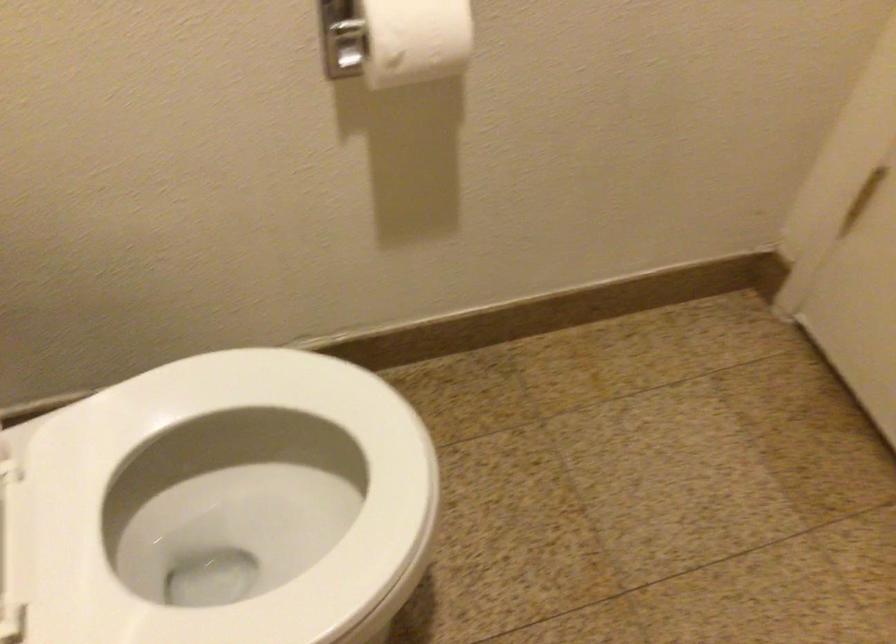
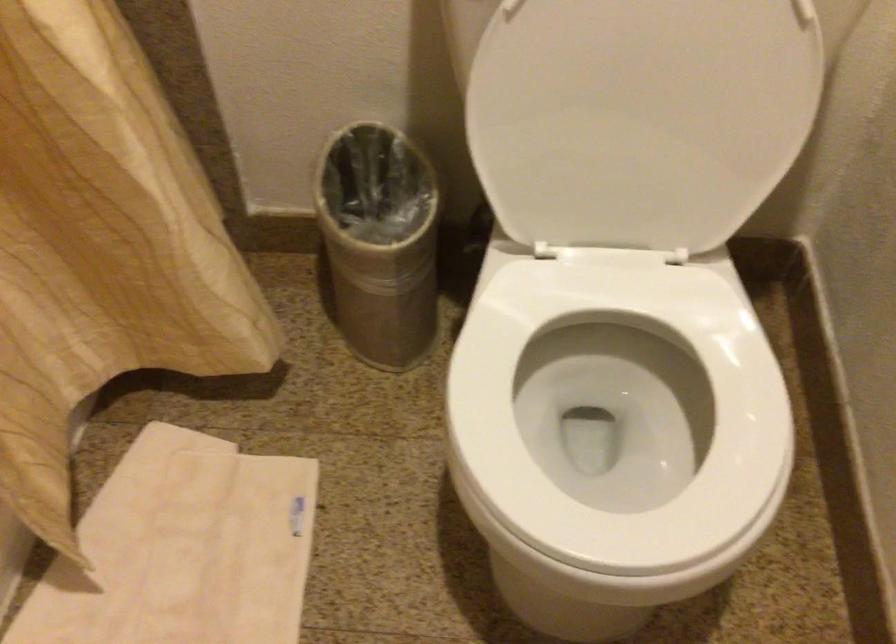
The first image is from the beginning of the video and the second image is from the end. How did the camera likely rotate when shooting the video?

The camera's rotation is toward left-down.